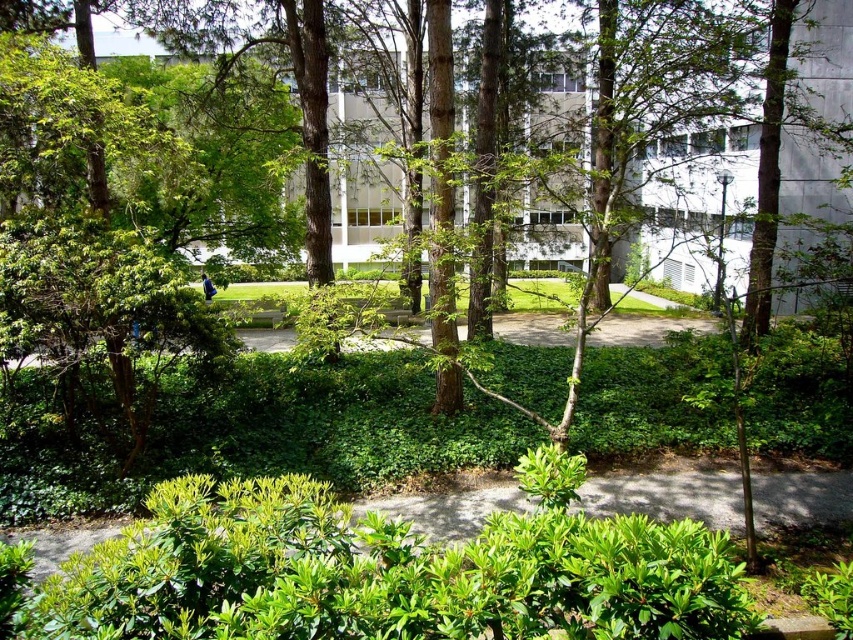
Between green leafy bush at center and green leafy tree at center, which one has less height?

green leafy bush at center is shorter.

Between point (368, 570) and point (271, 435), which one is positioned in front?

Point (368, 570) is in front.

Find the location of a particular element. This screenshot has height=640, width=853. green leafy bush at center is located at coordinates (386, 573).